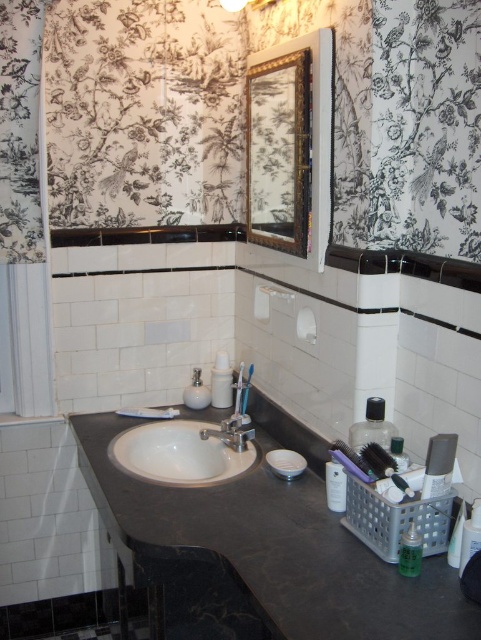
Question: Does white glossy sink at center have a smaller size compared to white glossy soap dispenser at center?

Choices:
 (A) yes
 (B) no

Answer: (B)

Question: Can you confirm if clear plastic container at right is thinner than clear plastic bottle at lower right?

Choices:
 (A) yes
 (B) no

Answer: (B)

Question: Which object is farther from the camera taking this photo?

Choices:
 (A) clear plastic bottle at center
 (B) white plastic toothbrush at center
 (C) translucent plastic container at center
 (D) white glossy sink at center

Answer: (B)

Question: Among these objects, which one is farthest from the camera?

Choices:
 (A) white glossy sink at center
 (B) black marble counter at center
 (C) clear plastic container at right
 (D) silver metallic faucet at center

Answer: (D)

Question: Does black marble counter at center have a greater width compared to translucent plastic bottle at lower right?

Choices:
 (A) yes
 (B) no

Answer: (A)

Question: Among these objects, which one is farthest from the camera?

Choices:
 (A) white glossy soap dispenser at center
 (B) gold-framed mirror at upper center
 (C) clear plastic bottle at center
 (D) silver metallic faucet at center

Answer: (A)